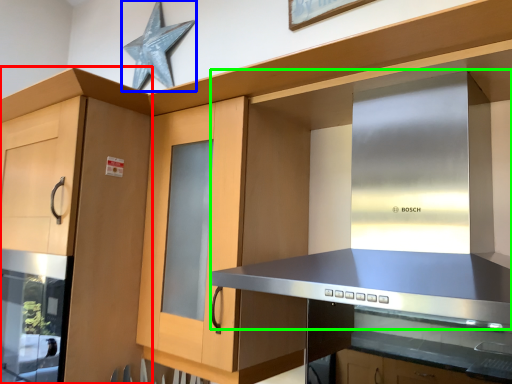
Question: Estimate the real-world distances between objects in this image. Which object is farther from cabinetry (highlighted by a red box), star (highlighted by a blue box) or vent (highlighted by a green box)?

Choices:
 (A) star
 (B) vent

Answer: (A)